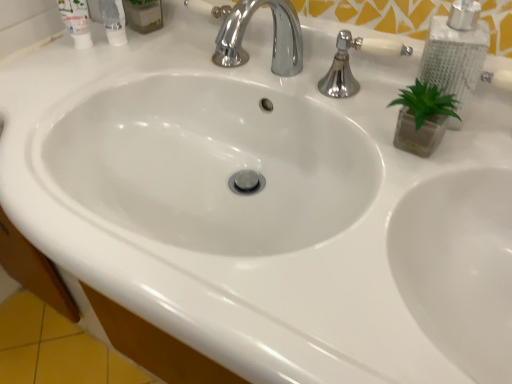
Where is `vacant space in between polished chrome faucet at upper center and white glossy tube at upper left, which appears as the 2th mouthwash when viewed from the right`? This screenshot has height=384, width=512. vacant space in between polished chrome faucet at upper center and white glossy tube at upper left, which appears as the 2th mouthwash when viewed from the right is located at coordinates (214, 80).